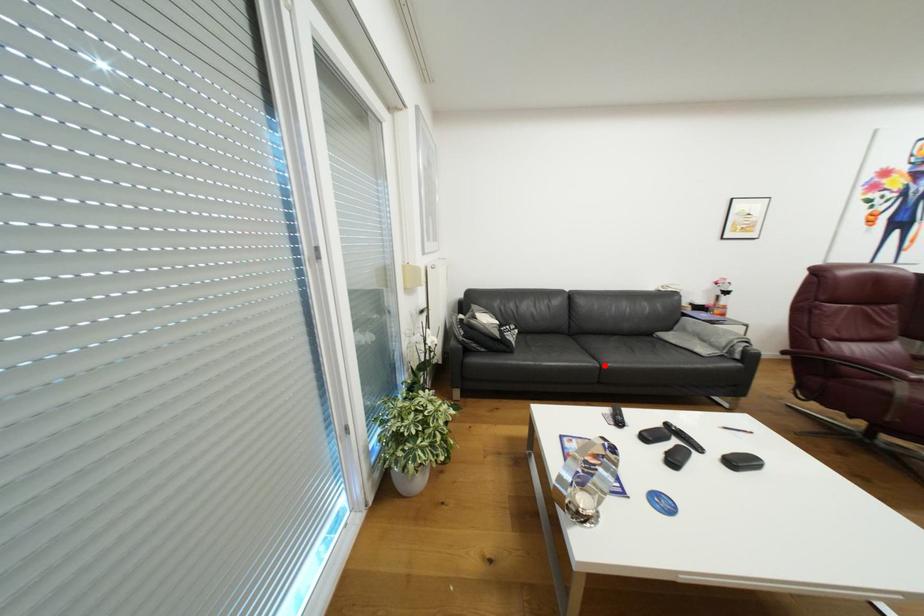
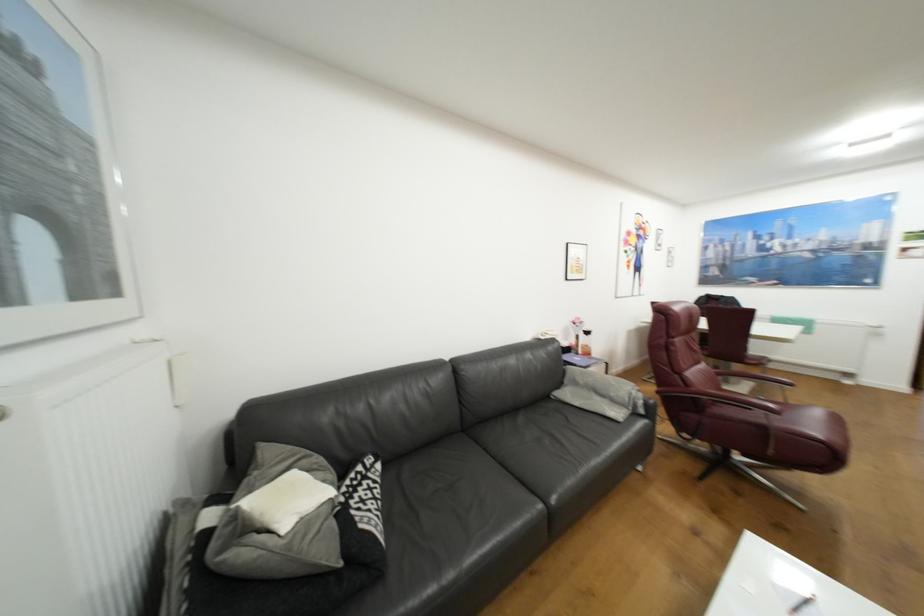
In the second image, find the point that corresponds to the highlighted location in the first image.

(548, 506)